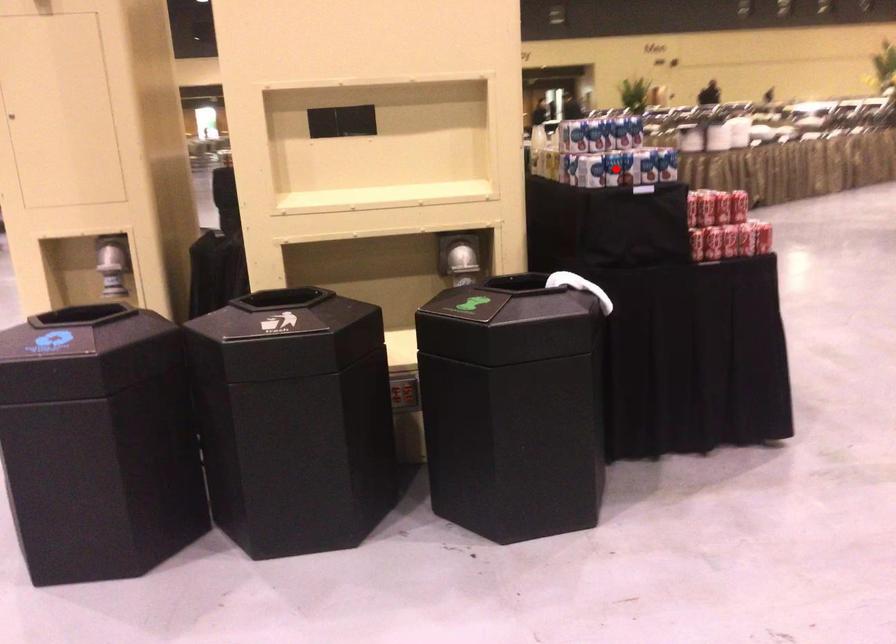
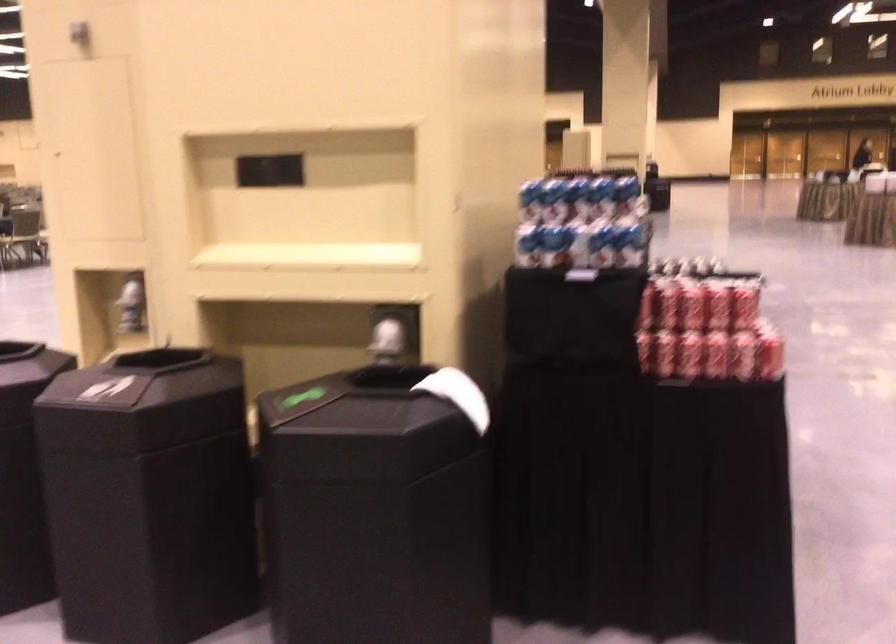
The point at the highlighted location is marked in the first image. Where is the corresponding point in the second image?

(553, 245)